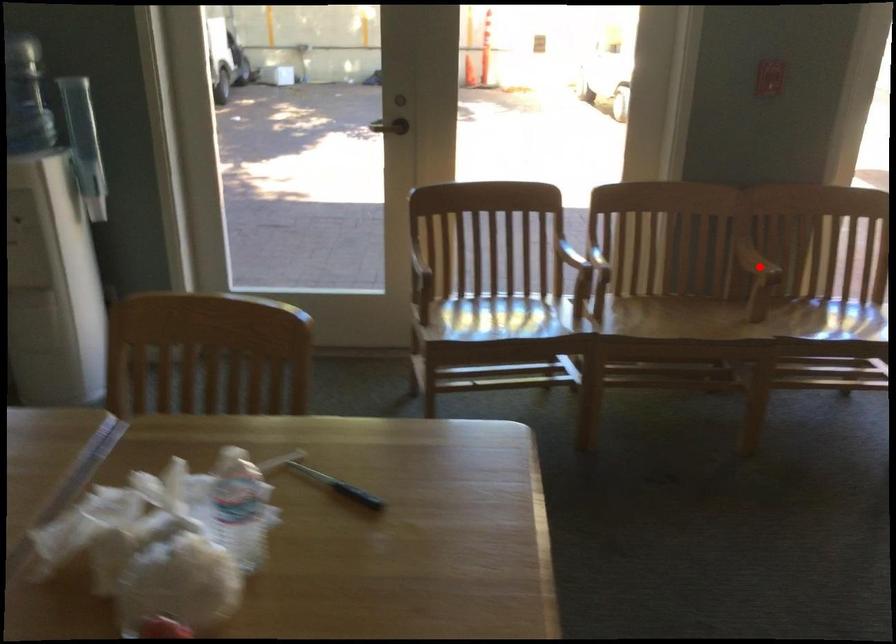
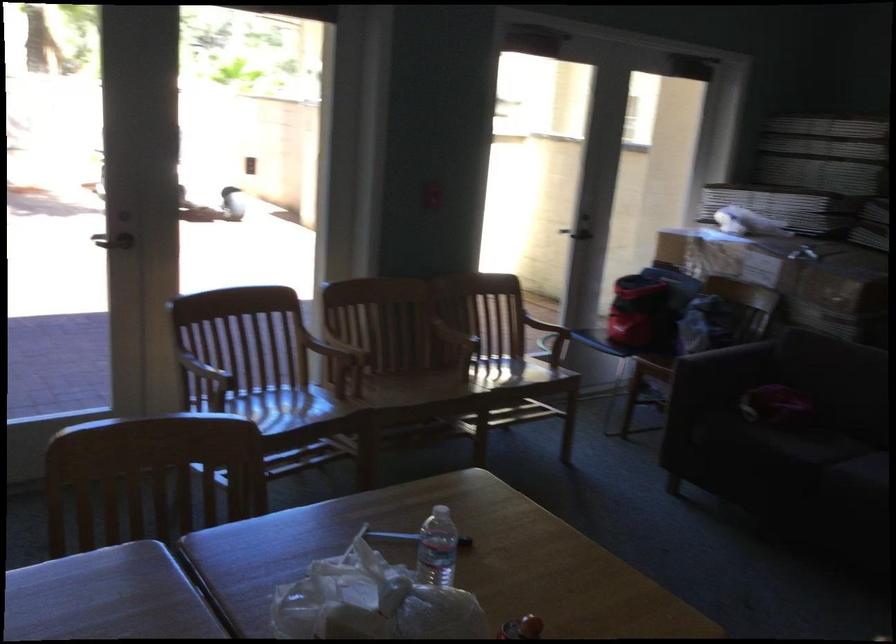
Where in the second image is the point corresponding to the highlighted location from the first image?

(460, 339)